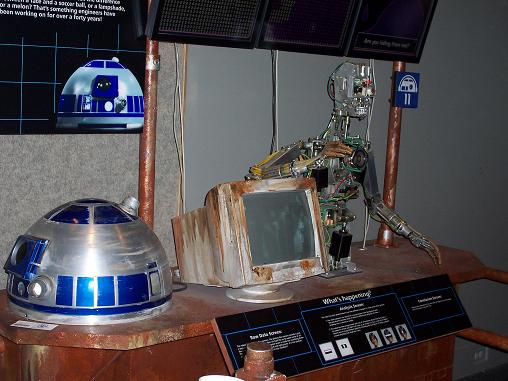
Locate an element on the screen. This screenshot has width=508, height=381. wires is located at coordinates (179, 113), (369, 129), (272, 108).